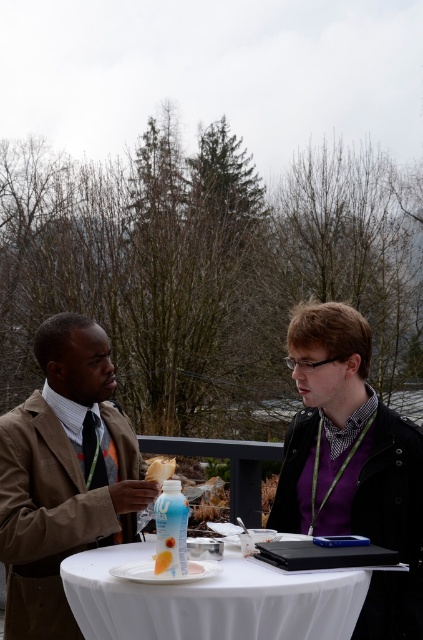
Is brown leather jacket at left shorter than yellow matte cupcake at center?

Incorrect, brown leather jacket at left's height does not fall short of yellow matte cupcake at center's.

Who is lower down, brown leather jacket at left or yellow matte cupcake at center?

yellow matte cupcake at center is below.

Where is `brown leather jacket at left`? brown leather jacket at left is located at coordinates (63, 476).

Can you confirm if purple matte shirt at center is wider than matte plastic bottle at table center?

Correct, the width of purple matte shirt at center exceeds that of matte plastic bottle at table center.

Is point (393, 605) farther from viewer compared to point (162, 490)?

Yes, point (393, 605) is farther from viewer.

In order to click on purple matte shirt at center in this screenshot , I will do `click(351, 464)`.

Does white cloth-covered table at center have a larger size compared to white matte cake at center?

Yes.

Does white cloth-covered table at center appear under white matte cake at center?

Correct, white cloth-covered table at center is located below white matte cake at center.

Between point (353, 588) and point (151, 465), which one is positioned behind?

Positioned behind is point (151, 465).

Where is `white cloth-covered table at center`? white cloth-covered table at center is located at coordinates (211, 600).